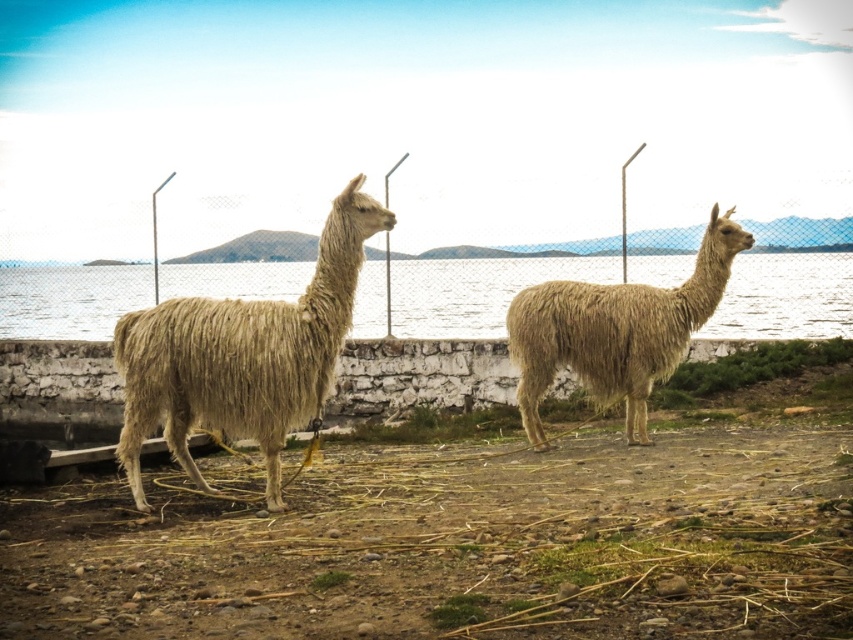
You are standing in the fenced enclosure with the two alpacas. You want to walk from the beige woolen alpaca at right to the clear blue water at center. Which direction should you head?

To reach the clear blue water at center from the beige woolen alpaca at right, you should head to the right, as the clear blue water at center is located to the right of the beige woolen alpaca at right.

You are standing in front of the fenced enclosure where the clear blue water at center and the light beige woolen alpaca at center are located. Which object is closer to you?

The light beige woolen alpaca at center is closer to you because it is positioned in front of the clear blue water at center, which is further away.

You are standing in front of the fenced enclosure where the clear blue water at center and the light beige woolen alpaca at center are present. From your perspective, which object is positioned higher in the image?

The clear blue water at center is located above the light beige woolen alpaca at center, so the clear blue water at center is higher in the image.